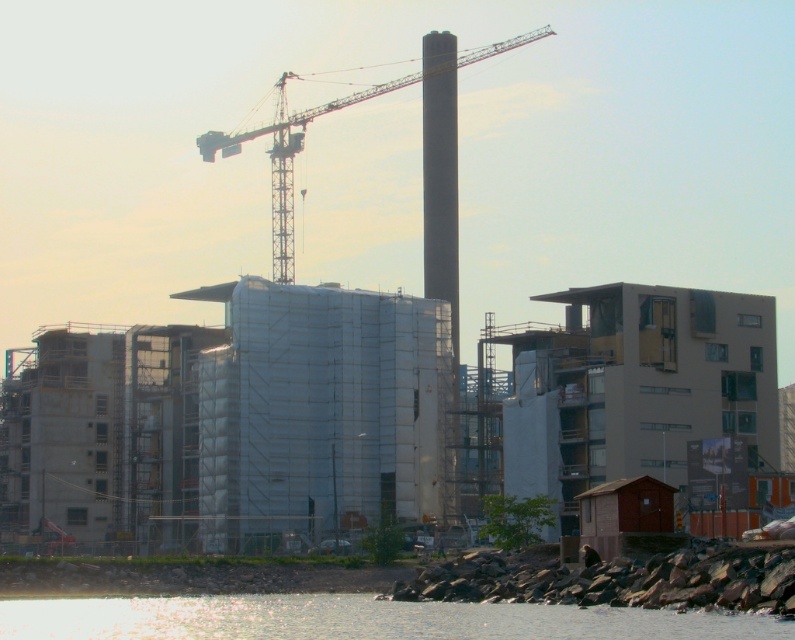
Looking at this image, who is shorter, transparent water at lower left or metallic gray crane at upper center?

transparent water at lower left

Is transparent water at lower left wider than metallic gray crane at upper center?

No, transparent water at lower left is not wider than metallic gray crane at upper center.

Locate an element on the screen. The width and height of the screenshot is (795, 640). transparent water at lower left is located at coordinates (359, 620).

In order to click on transparent water at lower left in this screenshot , I will do `click(359, 620)`.